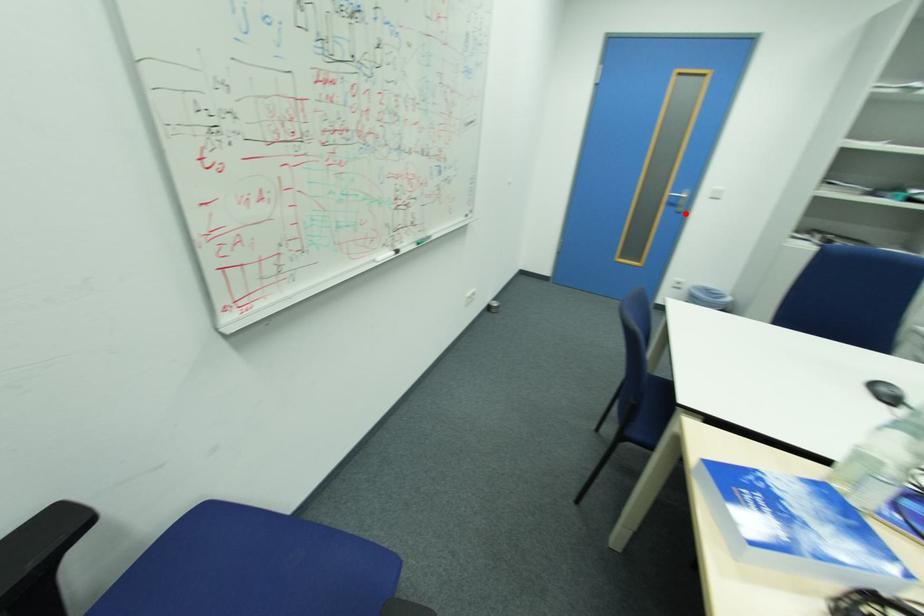
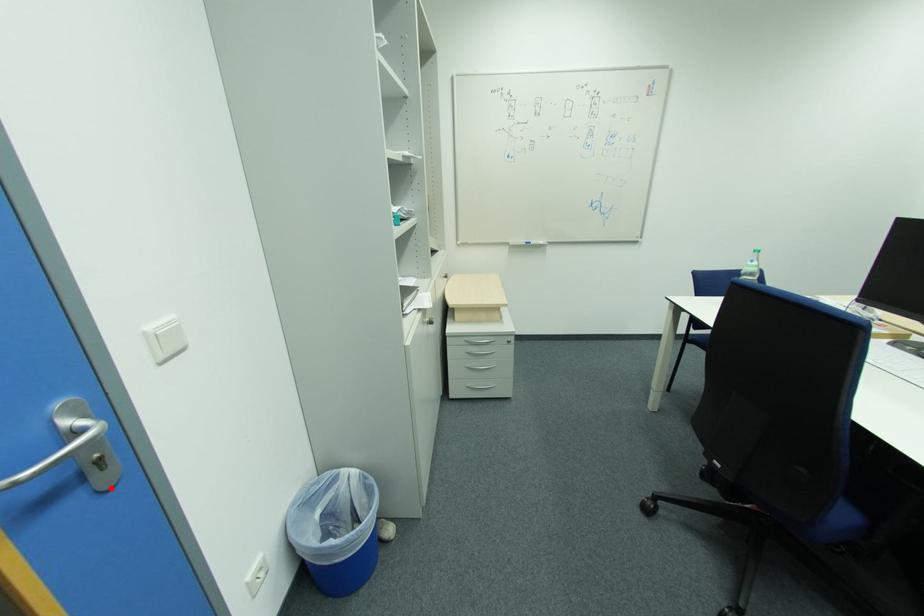
I am providing you with two images of the same scene from different viewpoints. A red point is marked on the first image and another point is marked on the second image. Are the points marked in image1 and image2 representing the same 3D position?

Yes